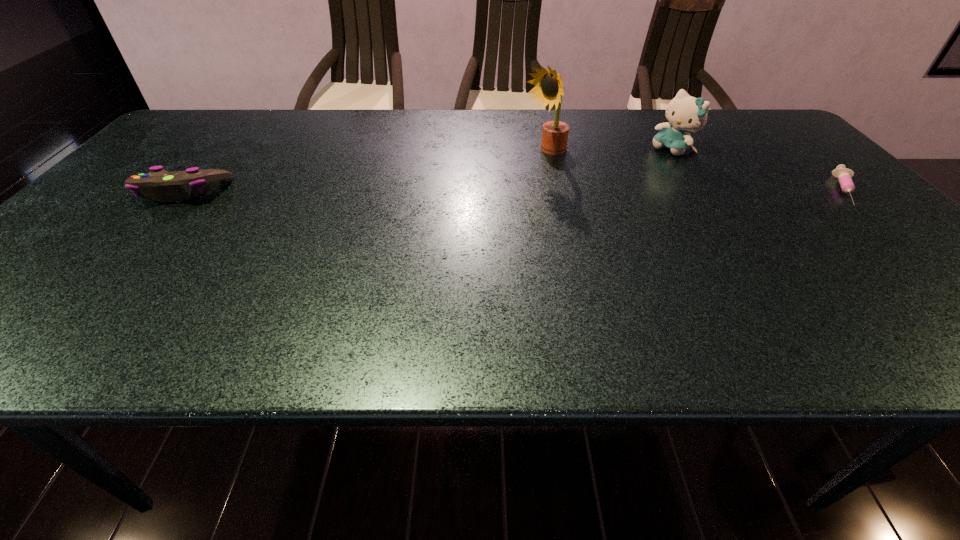
Identify the location of vacant space on the desktop that is between the leftmost object and the rightmost object and is positioned on the face of the second object from left to right. The image size is (960, 540). (474, 191).

Identify the location of free space on the desktop that is between the leftmost object and the syringe and is positioned on the face of the kitten. This screenshot has height=540, width=960. (605, 191).